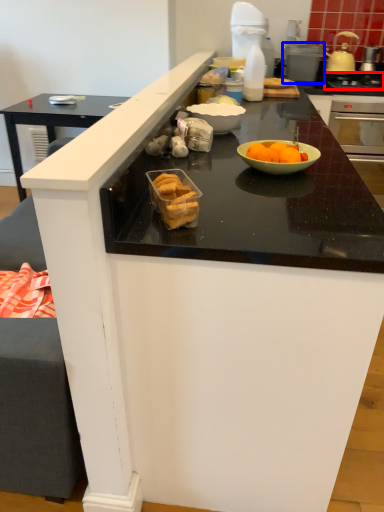
Question: Which of the following is the farthest to the observer, gas stove (highlighted by a red box) or appliance (highlighted by a blue box)?

Choices:
 (A) gas stove
 (B) appliance

Answer: (B)